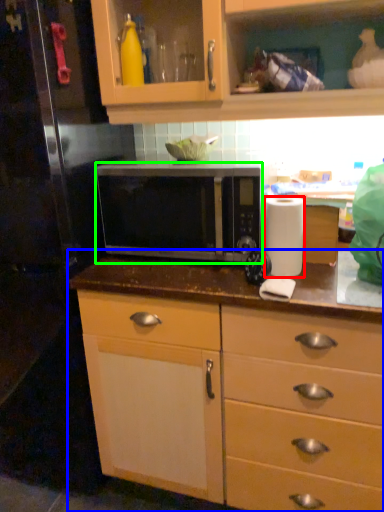
Question: Which object is positioned closest to paper towel (highlighted by a red box)? Select from countertop (highlighted by a blue box) and microwave oven (highlighted by a green box).

Choices:
 (A) countertop
 (B) microwave oven

Answer: (B)